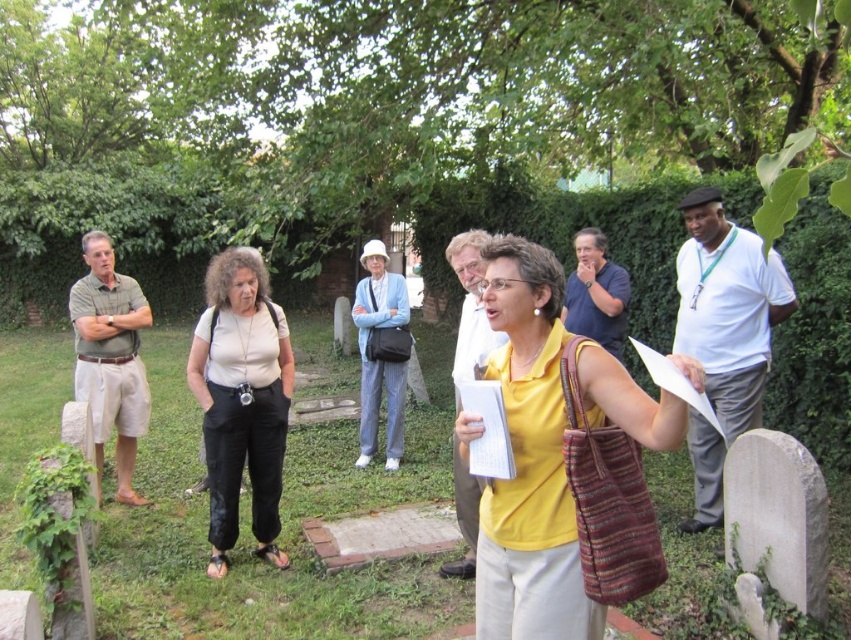
Who is higher up, yellow fabric shirt at center or blue cotton shirt at upper center?

blue cotton shirt at upper center is above.

In the scene shown: Is yellow fabric shirt at center wider than blue cotton shirt at upper center?

Yes, yellow fabric shirt at center is wider than blue cotton shirt at upper center.

The width and height of the screenshot is (851, 640). What do you see at coordinates (528, 460) in the screenshot?
I see `yellow fabric shirt at center` at bounding box center [528, 460].

The height and width of the screenshot is (640, 851). I want to click on yellow fabric shirt at center, so click(528, 460).

Does yellow fabric shirt at center have a larger size compared to green cotton shirt at left?

Actually, yellow fabric shirt at center might be smaller than green cotton shirt at left.

Does yellow fabric shirt at center have a smaller size compared to green cotton shirt at left?

Yes, yellow fabric shirt at center is smaller than green cotton shirt at left.

Locate an element on the screen. The width and height of the screenshot is (851, 640). yellow fabric shirt at center is located at coordinates (528, 460).

Identify the location of yellow fabric shirt at center. Image resolution: width=851 pixels, height=640 pixels. pos(528,460).

Who is more forward, (735, 330) or (592, 272)?

Positioned in front is point (735, 330).

Can you confirm if white cotton shirt at right is taller than blue cotton shirt at upper center?

Correct, white cotton shirt at right is much taller as blue cotton shirt at upper center.

Which is in front, point (730, 276) or point (584, 237)?

Positioned in front is point (730, 276).

Where is `white cotton shirt at right`? white cotton shirt at right is located at coordinates (724, 333).